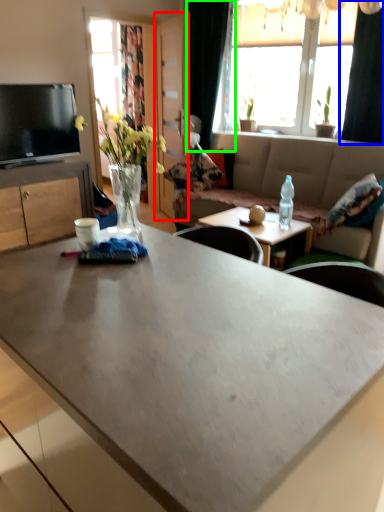
Question: Which is nearer to the glass door (highlighted by a red box)? curtain (highlighted by a blue box) or curtain (highlighted by a green box).

Choices:
 (A) curtain
 (B) curtain

Answer: (B)